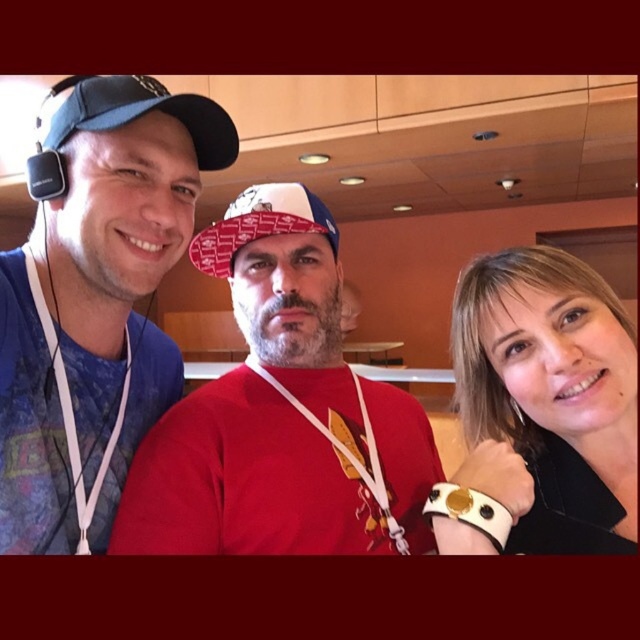
Question: Where is blue fabric baseball cap at left located in relation to white printed baseball cap at center in the image?

Choices:
 (A) right
 (B) left

Answer: (B)

Question: Which point is closer to the camera?

Choices:
 (A) (294, 186)
 (B) (131, 252)
 (C) (538, 497)

Answer: (B)

Question: Can you confirm if blue fabric baseball cap at left is wider than white printed baseball cap at center?

Choices:
 (A) yes
 (B) no

Answer: (B)

Question: Among these points, which one is nearest to the camera?

Choices:
 (A) (157, 108)
 (B) (545, 468)
 (C) (336, 253)

Answer: (A)

Question: Considering the real-world distances, which object is closest to the smooth white bracelet at right?

Choices:
 (A) white printed baseball cap at center
 (B) blue fabric baseball cap at left

Answer: (A)

Question: Is blue fabric baseball cap at left closer to camera compared to white printed baseball cap at center?

Choices:
 (A) no
 (B) yes

Answer: (B)